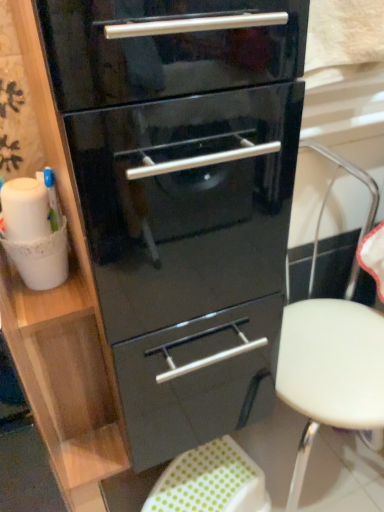
Question: From the image's perspective, is green polka dot fabric step stool at lower center under glossy black chest of drawers at center?

Choices:
 (A) yes
 (B) no

Answer: (A)

Question: Is green polka dot fabric step stool at lower center bigger than glossy black chest of drawers at center?

Choices:
 (A) no
 (B) yes

Answer: (A)

Question: Is green polka dot fabric step stool at lower center thinner than glossy black chest of drawers at center?

Choices:
 (A) no
 (B) yes

Answer: (B)

Question: Is green polka dot fabric step stool at lower center not within glossy black chest of drawers at center?

Choices:
 (A) yes
 (B) no

Answer: (A)

Question: Is green polka dot fabric step stool at lower center oriented towards glossy black chest of drawers at center?

Choices:
 (A) yes
 (B) no

Answer: (B)

Question: Is glossy black chest of drawers at center inside or outside of white plastic stool at center?

Choices:
 (A) outside
 (B) inside

Answer: (A)

Question: From a real-world perspective, relative to white plastic stool at center, is glossy black chest of drawers at center vertically above or below?

Choices:
 (A) above
 (B) below

Answer: (A)

Question: In the image, is glossy black chest of drawers at center positioned in front of or behind white plastic stool at center?

Choices:
 (A) behind
 (B) front

Answer: (B)

Question: From the image's perspective, is glossy black chest of drawers at center positioned above or below white plastic stool at center?

Choices:
 (A) below
 (B) above

Answer: (B)

Question: In the image, is glossy black chest of drawers at center on the left side or the right side of green polka dot fabric step stool at lower center?

Choices:
 (A) right
 (B) left

Answer: (B)

Question: Considering the positions of point (256, 48) and point (157, 490), is point (256, 48) closer or farther from the camera than point (157, 490)?

Choices:
 (A) closer
 (B) farther

Answer: (A)

Question: From the image's perspective, relative to green polka dot fabric step stool at lower center, is glossy black chest of drawers at center above or below?

Choices:
 (A) above
 (B) below

Answer: (A)

Question: From a real-world perspective, relative to green polka dot fabric step stool at lower center, is glossy black chest of drawers at center vertically above or below?

Choices:
 (A) below
 (B) above

Answer: (B)

Question: Is white plastic stool at center wider or thinner than green polka dot fabric step stool at lower center?

Choices:
 (A) thin
 (B) wide

Answer: (B)

Question: Considering the positions of white plastic stool at center and green polka dot fabric step stool at lower center in the image, is white plastic stool at center bigger or smaller than green polka dot fabric step stool at lower center?

Choices:
 (A) big
 (B) small

Answer: (A)